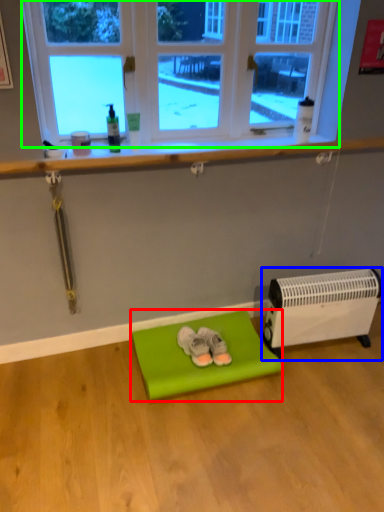
Question: Based on their relative distances, which object is farther from furniture (highlighted by a red box)? Choose from heater (highlighted by a blue box) and window (highlighted by a green box).

Choices:
 (A) heater
 (B) window

Answer: (B)